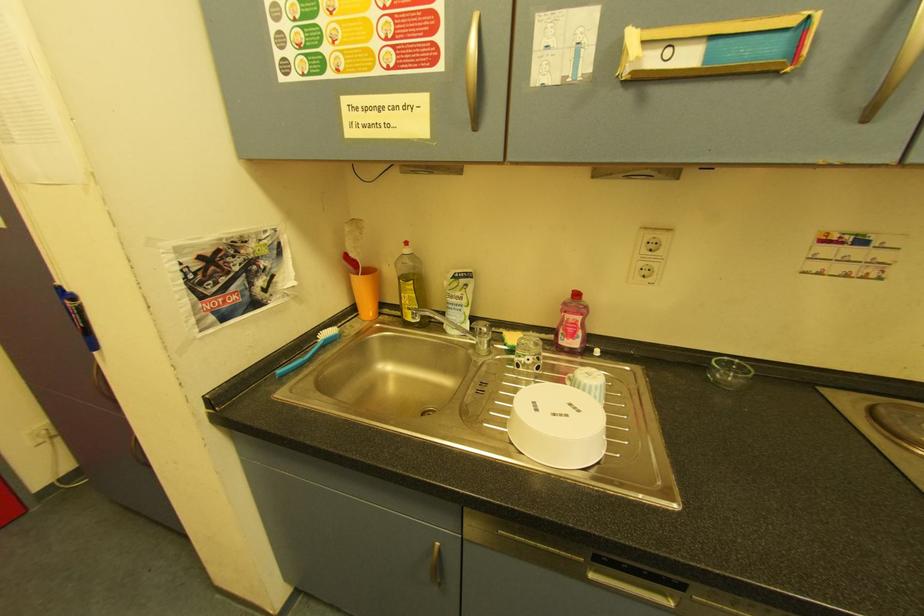
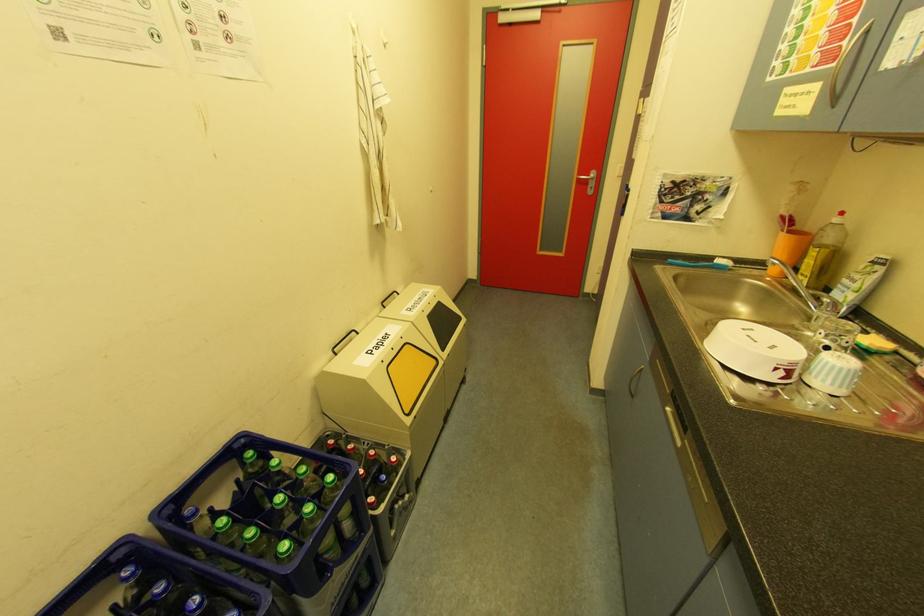
Based on the continuous images, in which direction is the camera rotating?

The rotation direction of the camera is left-down.